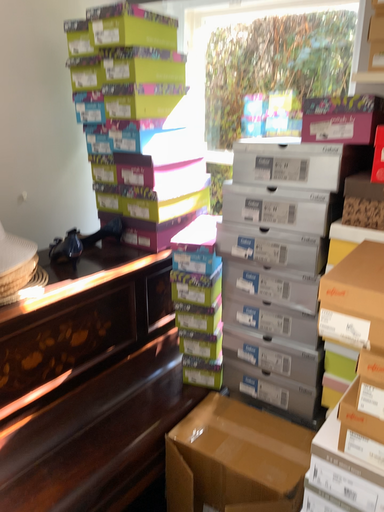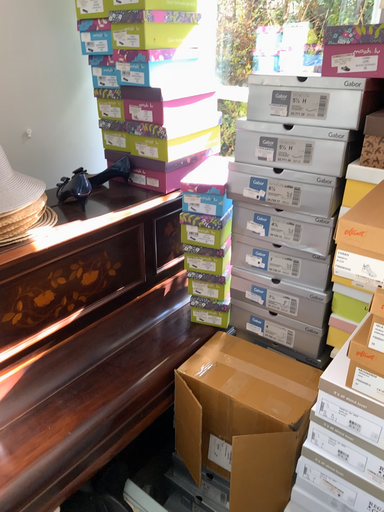
Question: Which way did the camera rotate in the video?

Choices:
 (A) rotated upward
 (B) rotated downward

Answer: (B)